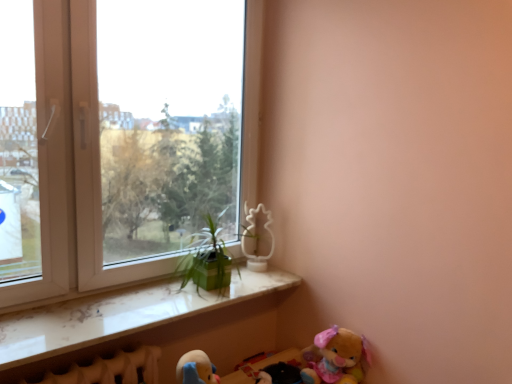
Question: Could you tell me if white matte pineapple at upper center, the 2th toy in the front-to-back sequence, is turned towards white marble window sill at lower left?

Choices:
 (A) no
 (B) yes

Answer: (A)

Question: From a real-world perspective, is white matte pineapple at upper center, which is counted as the 2th toy, starting from the bottom, physically above white marble window sill at lower left?

Choices:
 (A) no
 (B) yes

Answer: (B)

Question: Considering the relative sizes of white matte pineapple at upper center, positioned as the second toy in right-to-left order, and white marble window sill at lower left in the image provided, is white matte pineapple at upper center, positioned as the second toy in right-to-left order, shorter than white marble window sill at lower left?

Choices:
 (A) no
 (B) yes

Answer: (A)

Question: From a real-world perspective, is white matte pineapple at upper center, which is counted as the 2th toy, starting from the bottom, beneath white marble window sill at lower left?

Choices:
 (A) yes
 (B) no

Answer: (B)

Question: Does white matte pineapple at upper center, which is the 1th toy in top-to-bottom order, come in front of white marble window sill at lower left?

Choices:
 (A) no
 (B) yes

Answer: (A)

Question: Can white marble window sill at lower left be found inside white matte pineapple at upper center, the 2th toy in the front-to-back sequence?

Choices:
 (A) no
 (B) yes

Answer: (A)

Question: From the image's perspective, is white plastic window at upper left on fluffy plush bear at lower right, the first toy when ordered from right to left?

Choices:
 (A) yes
 (B) no

Answer: (A)

Question: Considering the relative sizes of white plastic window at upper left and fluffy plush bear at lower right, arranged as the second toy when viewed from the back, in the image provided, is white plastic window at upper left bigger than fluffy plush bear at lower right, arranged as the second toy when viewed from the back,?

Choices:
 (A) no
 (B) yes

Answer: (B)

Question: Does white plastic window at upper left lie behind fluffy plush bear at lower right, positioned as the second toy in left-to-right order?

Choices:
 (A) yes
 (B) no

Answer: (B)

Question: Is white plastic window at upper left touching fluffy plush bear at lower right, the first toy when ordered from right to left?

Choices:
 (A) no
 (B) yes

Answer: (A)

Question: Is white plastic window at upper left thinner than fluffy plush bear at lower right, the first toy when ordered from right to left?

Choices:
 (A) yes
 (B) no

Answer: (A)

Question: Does white plastic window at upper left turn towards fluffy plush bear at lower right, the first toy when ordered from right to left?

Choices:
 (A) no
 (B) yes

Answer: (B)

Question: Is the position of white marble window sill at lower left more distant than that of white plastic window at upper left?

Choices:
 (A) yes
 (B) no

Answer: (B)